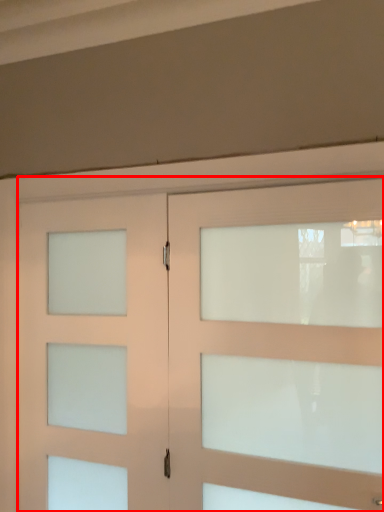
Question: From the image's perspective, where is door (annotated by the red box) located relative to door?

Choices:
 (A) below
 (B) above

Answer: (B)